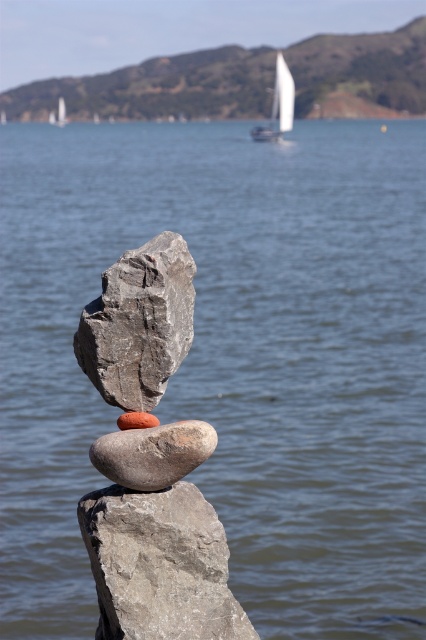
Does point (170, 621) come closer to viewer compared to point (279, 84)?

Yes, point (170, 621) is closer to viewer.

In order to click on gray rough rock at center in this screenshot , I will do `click(160, 564)`.

Who is more forward, (109,104) or (176,317)?

Point (176,317) is in front.

Is point (238, 61) more distant than point (187, 294)?

Yes.

Where is `smooth gray rock at upper center`? This screenshot has height=640, width=426. smooth gray rock at upper center is located at coordinates (158, 88).

Between smooth gray rock at upper center and gray rough rock at center, which one is positioned higher?

smooth gray rock at upper center is above.

Between point (288, 52) and point (152, 506), which one is positioned behind?

Point (288, 52)

In order to click on smooth gray rock at upper center in this screenshot , I will do `click(158, 88)`.